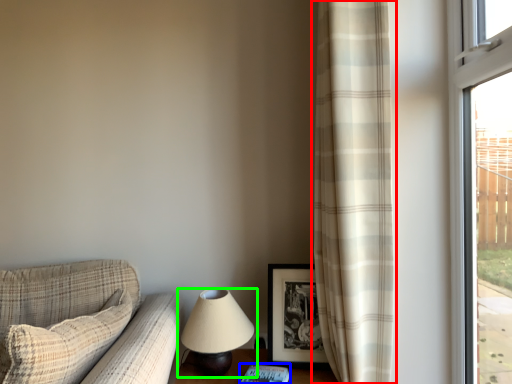
Question: Which object is positioned farthest from curtain (highlighted by a red box)? Select from book (highlighted by a blue box) and lamp (highlighted by a green box).

Choices:
 (A) book
 (B) lamp

Answer: (A)